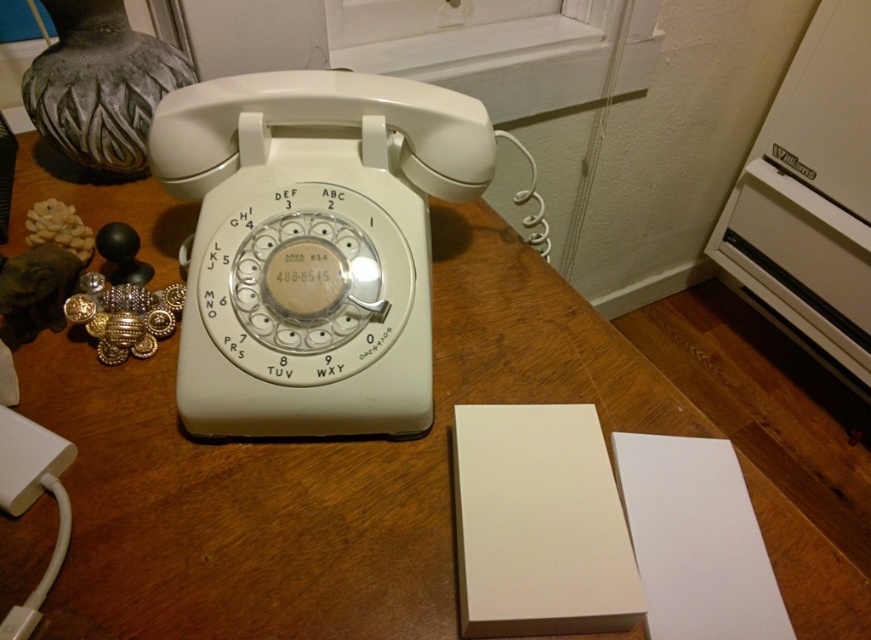
Question: Is white wood table at center smaller than white plastic rotary phone at center?

Choices:
 (A) no
 (B) yes

Answer: (A)

Question: Is white wood table at center smaller than white plastic rotary phone at center?

Choices:
 (A) no
 (B) yes

Answer: (A)

Question: Which point appears farthest from the camera in this image?

Choices:
 (A) (63, 339)
 (B) (341, 412)

Answer: (A)

Question: Considering the relative positions of white wood table at center and white plastic rotary phone at center in the image provided, where is white wood table at center located with respect to white plastic rotary phone at center?

Choices:
 (A) below
 (B) above

Answer: (A)

Question: Which point appears farthest from the camera in this image?

Choices:
 (A) (194, 125)
 (B) (366, 570)

Answer: (A)